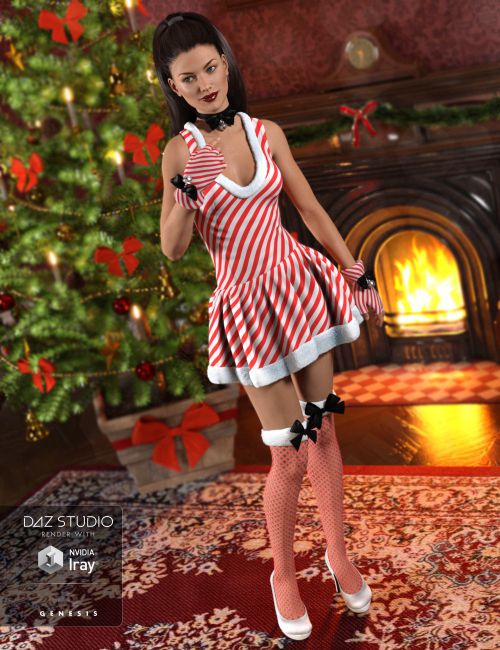
At what (x,y) coordinates should I click in order to perform the action: click on christmas tree. Please return your answer as a coordinate pair (x, y). This screenshot has width=500, height=650. Looking at the image, I should click on (106, 58).